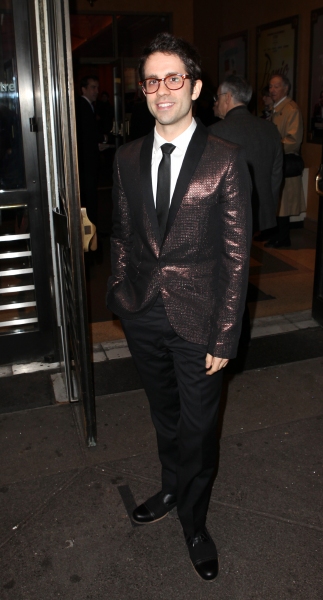
The width and height of the screenshot is (323, 600). I want to click on glass, so click(x=179, y=84).